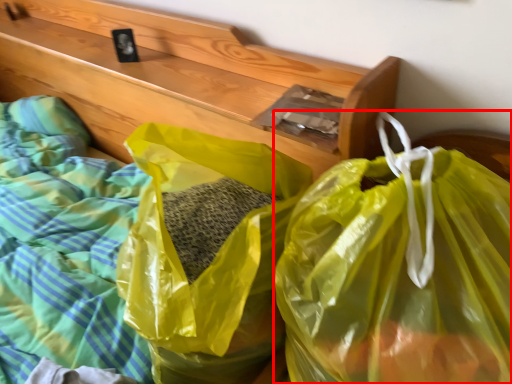
Question: From the image's perspective, what is the correct spatial positioning of plastic bag (annotated by the red box) in reference to plastic bag?

Choices:
 (A) above
 (B) below

Answer: (B)